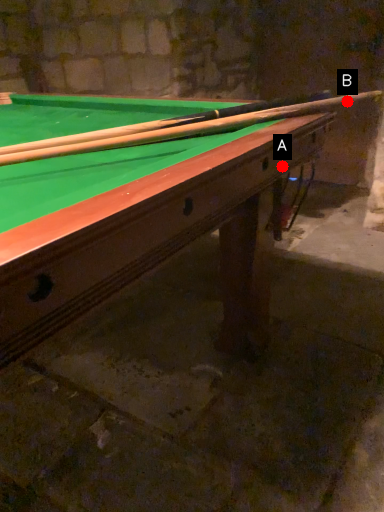
Question: Two points are circled on the image, labeled by A and B beside each circle. Which of the following is the farthest from the observer?

Choices:
 (A) A is further
 (B) B is further

Answer: (B)